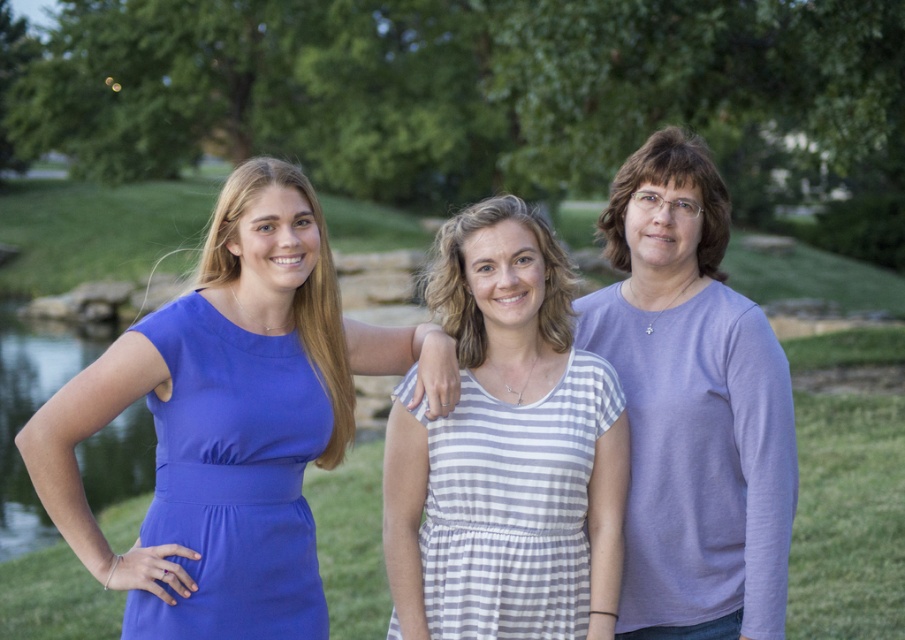
Who is more distant from viewer, (745, 308) or (153, 435)?

The point (153, 435) is behind.

Is point (661, 240) behind point (135, 422)?

No, (661, 240) is closer to viewer.

Locate an element on the screen. The width and height of the screenshot is (905, 640). purple cotton shirt at center is located at coordinates (692, 406).

In the scene shown: Which is above, matte purple sweater at center or white striped fabric dress at center?

matte purple sweater at center is above.

Who is more distant from viewer, (x=154, y=516) or (x=589, y=451)?

The point (x=589, y=451) is more distant.

Where is `matte purple sweater at center`? matte purple sweater at center is located at coordinates (231, 420).

Find the location of a particular element. matte purple sweater at center is located at coordinates (231, 420).

Based on the photo, who is more forward, (674, 532) or (484, 637)?

Point (484, 637)

Is point (686, 556) in front of point (545, 600)?

No, (686, 556) is behind (545, 600).

The width and height of the screenshot is (905, 640). Identify the location of purple cotton shirt at center. (692, 406).

Identify the location of purple cotton shirt at center. (692, 406).